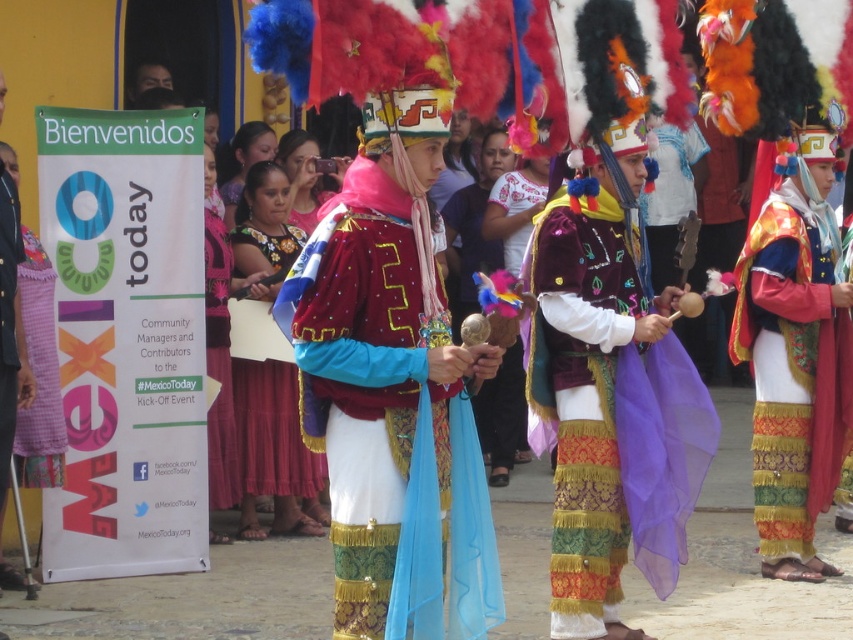
Between shiny velvet vest at center and pink checkered fabric at left, which one is positioned higher?

pink checkered fabric at left is above.

Which is behind, point (433, 474) or point (32, 310)?

Point (32, 310)

Between point (480, 618) and point (32, 291), which one is positioned in front?

Positioned in front is point (480, 618).

This screenshot has width=853, height=640. I want to click on shiny velvet vest at center, so click(393, 408).

What do you see at coordinates (271, 432) in the screenshot?
I see `shiny blue fabric at center` at bounding box center [271, 432].

Is shiny blue fabric at center thinner than matte pink fabric at center?

No.

The height and width of the screenshot is (640, 853). Identify the location of shiny blue fabric at center. (271, 432).

At what (x,y) coordinates should I click in order to perform the action: click on shiny blue fabric at center. Please return your answer as a coordinate pair (x, y). Looking at the image, I should click on (271, 432).

Between pink checkered fabric at left and shiny gold jacket at center, which one is positioned higher?

shiny gold jacket at center

I want to click on pink checkered fabric at left, so click(x=39, y=372).

Locate an element on the screen. Image resolution: width=853 pixels, height=640 pixels. pink checkered fabric at left is located at coordinates (39, 372).